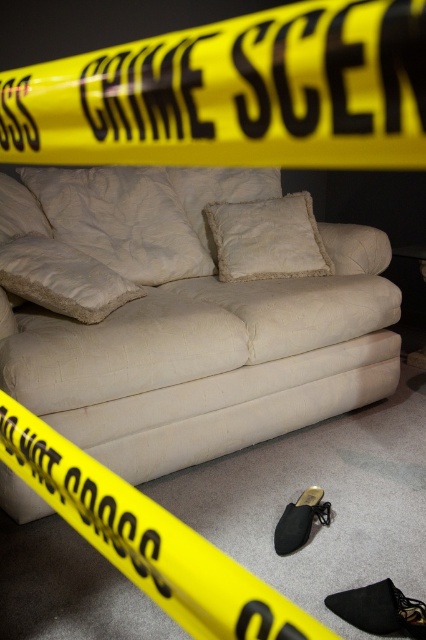
Question: Can you confirm if yellow plastic tape at lower center is positioned below fuzzy white pillow at center?

Choices:
 (A) yes
 (B) no

Answer: (A)

Question: Does yellow plastic tape at lower center appear on the left side of white textured pillow at center?

Choices:
 (A) yes
 (B) no

Answer: (B)

Question: Can you confirm if white fabric couch at center is smaller than white fluffy pillow at center?

Choices:
 (A) yes
 (B) no

Answer: (B)

Question: Estimate the real-world distances between objects in this image. Which object is closer to the white fluffy pillow at center?

Choices:
 (A) yellow plastic tape at lower center
 (B) white textured pillow at center
 (C) white fabric couch at center

Answer: (C)

Question: Among these points, which one is nearest to the camera?

Choices:
 (A) (308, 616)
 (B) (62, 188)
 (C) (42, 320)

Answer: (A)

Question: Which of the following is the farthest from the observer?

Choices:
 (A) fuzzy white pillow at center
 (B) yellow plastic tape at lower center
 (C) white fabric couch at center
 (D) white textured pillow at center

Answer: (A)